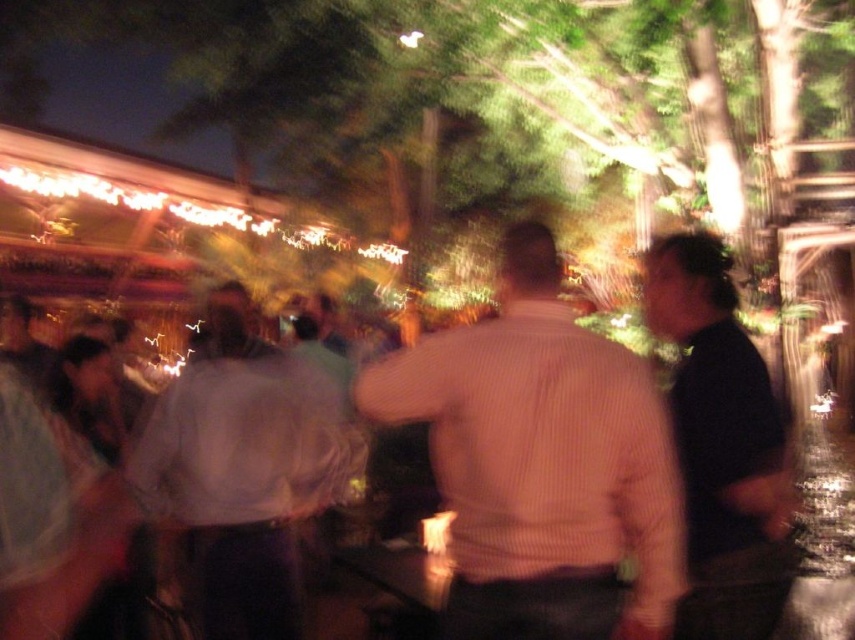
Question: Is light brown wood table at center to the left of black matte shirt at right from the viewer's perspective?

Choices:
 (A) no
 (B) yes

Answer: (B)

Question: Is light brown wood table at center to the left of light brown striped shirt at center from the viewer's perspective?

Choices:
 (A) yes
 (B) no

Answer: (B)

Question: In this image, where is light brown wood table at center located relative to light brown striped shirt at center?

Choices:
 (A) below
 (B) above

Answer: (B)

Question: Among these objects, which one is farthest from the camera?

Choices:
 (A) light brown wood table at center
 (B) white cotton shirt at center
 (C) black matte shirt at right

Answer: (B)

Question: Which object is the closest to the black matte shirt at right?

Choices:
 (A) light brown striped shirt at center
 (B) light brown wood table at center
 (C) white cotton shirt at center

Answer: (B)

Question: Which object appears farthest from the camera in this image?

Choices:
 (A) light brown wood table at center
 (B) black matte shirt at right
 (C) white cotton shirt at center

Answer: (C)